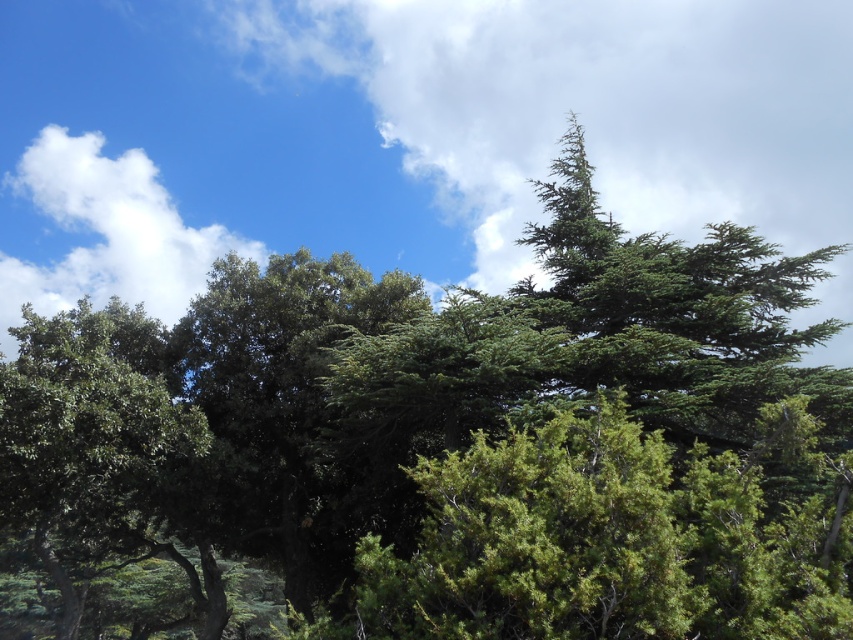
Question: Is green matte tree at left thinner than white fluffy cloud at upper left?

Choices:
 (A) no
 (B) yes

Answer: (B)

Question: Which object appears farthest from the camera in this image?

Choices:
 (A) white fluffy cloud at upper left
 (B) green matte tree at left

Answer: (A)

Question: Does green matte tree at left appear on the left side of white fluffy cloud at upper left?

Choices:
 (A) no
 (B) yes

Answer: (A)

Question: Where is green matte tree at left located in relation to white fluffy cloud at upper left in the image?

Choices:
 (A) right
 (B) left

Answer: (A)